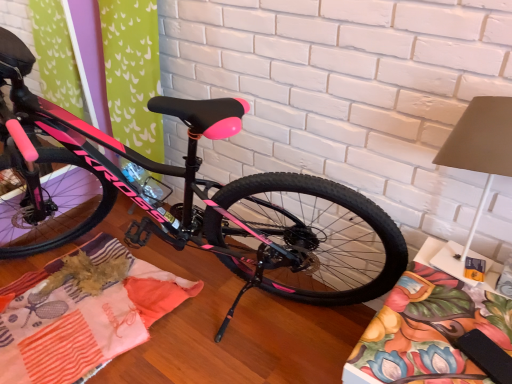
Find the location of a particular element. vacant area situated below pink glossy bicycle at center (from a real-world perspective) is located at coordinates (216, 318).